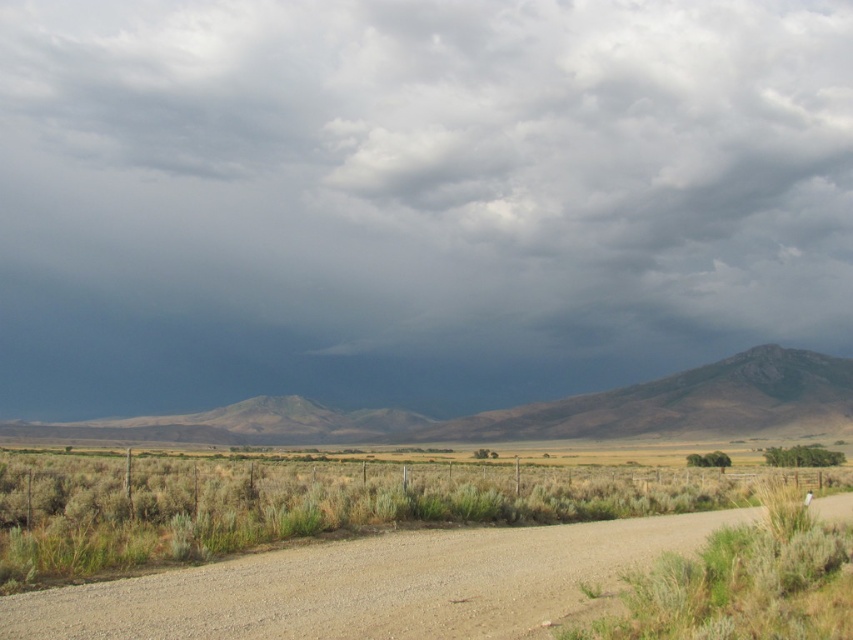
Does dark gray cloud at upper center have a lesser width compared to rugged rock mountain at center?

Incorrect, dark gray cloud at upper center's width is not less than rugged rock mountain at center's.

You are a GUI agent. You are given a task and a screenshot of the screen. Output one action in this format:
    pyautogui.click(x=<x>, y=<y>)
    Task: Click on the dark gray cloud at upper center
    This screenshot has width=853, height=640.
    Given the screenshot: What is the action you would take?
    (412, 198)

In order to click on dark gray cloud at upper center in this screenshot , I will do `click(412, 198)`.

Between point (424, 10) and point (561, 404), which one is positioned behind?

The point (424, 10) is more distant.

Is dark gray cloud at upper center bigger than rugged brown mountain at center?

Correct, dark gray cloud at upper center is larger in size than rugged brown mountain at center.

At what (x,y) coordinates should I click in order to perform the action: click on dark gray cloud at upper center. Please return your answer as a coordinate pair (x, y). Looking at the image, I should click on (412, 198).

The height and width of the screenshot is (640, 853). In order to click on dark gray cloud at upper center in this screenshot , I will do `click(412, 198)`.

Who is shorter, dark gray cloud at upper center or green grass at center?

Standing shorter between the two is green grass at center.

This screenshot has width=853, height=640. What do you see at coordinates (412, 198) in the screenshot? I see `dark gray cloud at upper center` at bounding box center [412, 198].

The image size is (853, 640). Identify the location of dark gray cloud at upper center. (412, 198).